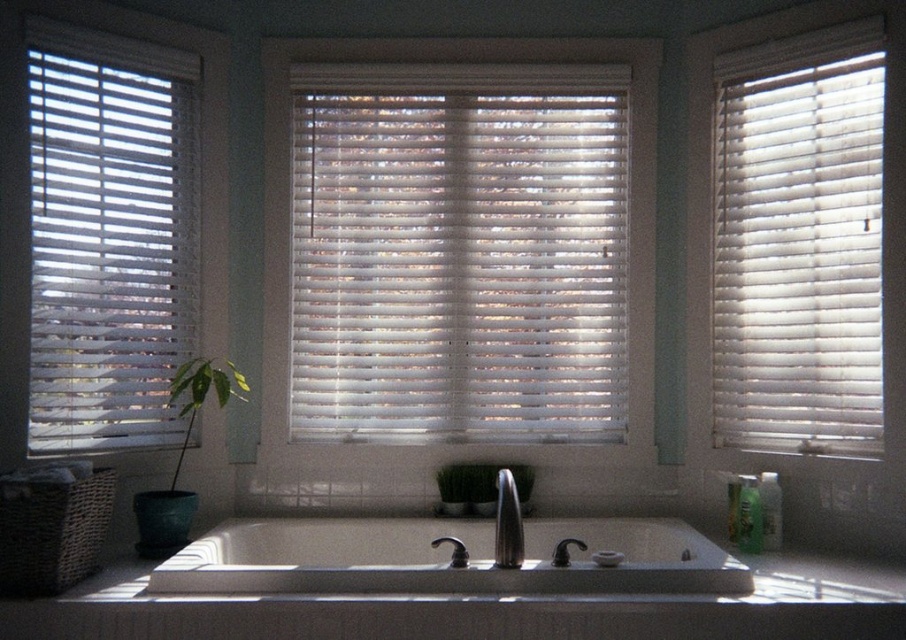
Consider the image. You are a bathroom designer planning to install a new mirror above the white matte sink at center. The mirror requires a 10 cm clearance on all sides. Given the sink is at position point 0.873, 0.497, can you determine if there is enough space to install the mirror without overlapping any existing fixtures?

The white matte sink at center is positioned at point (449, 557). Since the mirror requires 10 cm clearance on all sides, and no other fixtures are mentioned in the scene description, there should be sufficient space to install the mirror without overlapping existing fixtures.